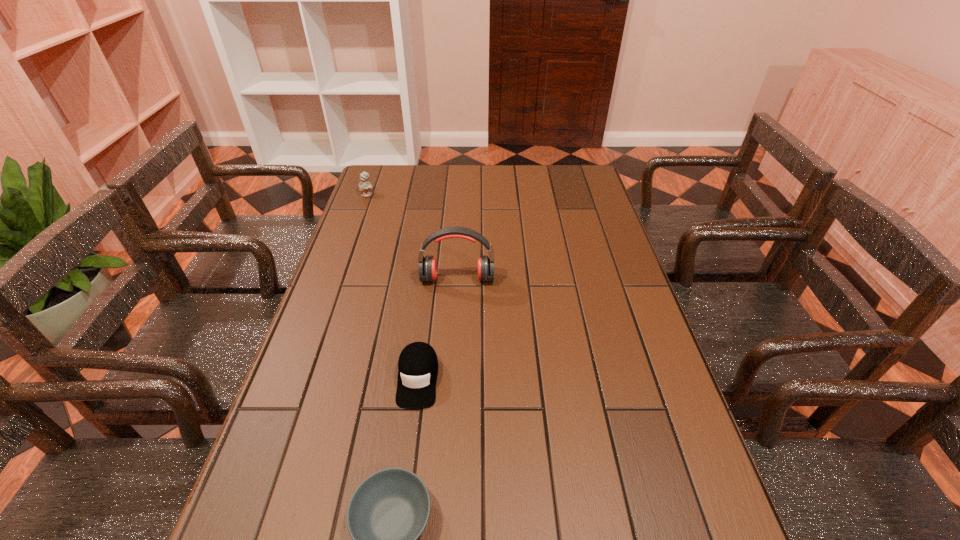
Locate an element on the screen. The height and width of the screenshot is (540, 960). the tallest object is located at coordinates (427, 265).

I want to click on earphone, so click(x=427, y=265).

This screenshot has width=960, height=540. What are the coordinates of `the leftmost object` in the screenshot? It's located at (365, 186).

You are a GUI agent. You are given a task and a screenshot of the screen. Output one action in this format:
    pyautogui.click(x=<x>, y=<y>)
    Task: Click on the second tallest object
    The image size is (960, 540).
    Given the screenshot: What is the action you would take?
    pyautogui.click(x=365, y=186)

Where is `the third farthest object`? The height and width of the screenshot is (540, 960). the third farthest object is located at coordinates (418, 365).

You are a GUI agent. You are given a task and a screenshot of the screen. Output one action in this format:
    pyautogui.click(x=<x>, y=<y>)
    Task: Click on the second shortest object
    
    Given the screenshot: What is the action you would take?
    pyautogui.click(x=418, y=365)

The width and height of the screenshot is (960, 540). I want to click on free space located on the ear cups of the tallest object, so click(455, 326).

You are a GUI agent. You are given a task and a screenshot of the screen. Output one action in this format:
    pyautogui.click(x=<x>, y=<y>)
    Task: Click on the vacant area situated on the front-facing side of the leftmost object
    
    Given the screenshot: What is the action you would take?
    pyautogui.click(x=361, y=214)

Locate an element on the screen. The width and height of the screenshot is (960, 540). vacant region located 0.140m on the front-facing side of the third farthest object is located at coordinates (406, 472).

Find the location of a particular element. This screenshot has height=540, width=960. object that is positioned at the far edge is located at coordinates (365, 186).